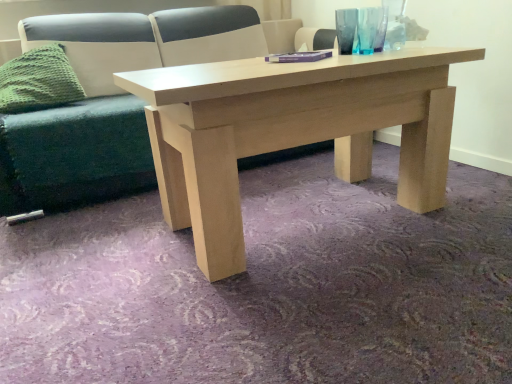
Find the location of a particular element. transparent glass vase at upper right is located at coordinates (367, 29).

The image size is (512, 384). Describe the element at coordinates (74, 155) in the screenshot. I see `green fabric couch at center` at that location.

Find the location of a particular element. transparent glass vase at upper right is located at coordinates (367, 29).

Is green knitted pillow at left bigger or smaller than green fabric couch at center?

In the image, green knitted pillow at left appears to be smaller than green fabric couch at center.

Can you tell me how much green knitted pillow at left and green fabric couch at center differ in facing direction?

They differ by 0.000168 degrees in their facing directions.

Considering the points (48, 100) and (128, 180), which point is behind, point (48, 100) or point (128, 180)?

Point (48, 100)

Could you tell me if green knitted pillow at left is turned towards green fabric couch at center?

Yes.

Where is `studio couch that is above the purple matte book at center (from the image's perspective)`? The image size is (512, 384). studio couch that is above the purple matte book at center (from the image's perspective) is located at coordinates (74, 155).

In terms of width, does green fabric couch at center look wider or thinner when compared to purple matte book at center?

Considering their sizes, green fabric couch at center looks broader than purple matte book at center.

Based on the photo, from a real-world perspective, which object stands above the other?

purple matte book at center, from a real-world perspective.

Looking at this image, is green fabric couch at center taller or shorter than purple matte book at center?

Considering their sizes, green fabric couch at center has more height than purple matte book at center.

Based on the photo, how much distance is there between green knitted pillow at left and purple matte book at center?

green knitted pillow at left is 3.96 feet from purple matte book at center.

You are a GUI agent. You are given a task and a screenshot of the screen. Output one action in this format:
    pyautogui.click(x=<x>, y=<y>)
    Task: Click on the book that is above the green knitted pillow at left (from a real-world perspective)
    The image size is (512, 384).
    Given the screenshot: What is the action you would take?
    pyautogui.click(x=298, y=57)

Considering the sizes of green knitted pillow at left and purple matte book at center in the image, is green knitted pillow at left wider or thinner than purple matte book at center?

green knitted pillow at left is wider than purple matte book at center.

Does green knitted pillow at left come behind purple matte book at center?

Yes, green knitted pillow at left is further from the viewer.

Is green fabric couch at center facing away from transparent glass vase at upper right?

green fabric couch at center is not turned away from transparent glass vase at upper right.

Can you tell me how much green fabric couch at center and transparent glass vase at upper right differ in facing direction?

green fabric couch at center and transparent glass vase at upper right are facing 1.16 degrees away from each other.

From the image's perspective, which is below, green fabric couch at center or transparent glass vase at upper right?

From the image's view, green fabric couch at center is below.

Image resolution: width=512 pixels, height=384 pixels. What are the coordinates of `glass vase behind the green fabric couch at center` in the screenshot? It's located at (367, 29).

From a real-world perspective, is transparent glass vase at upper right above or below green fabric couch at center?

From a real-world perspective, transparent glass vase at upper right is physically above green fabric couch at center.

Would you say transparent glass vase at upper right is a long distance from green fabric couch at center?

Yes, transparent glass vase at upper right and green fabric couch at center are quite far apart.

From the picture: In terms of size, does transparent glass vase at upper right appear bigger or smaller than green fabric couch at center?

transparent glass vase at upper right is smaller than green fabric couch at center.

Is transparent glass vase at upper right to the left of green fabric couch at center from the viewer's perspective?

No.

In the scene shown: From the image's perspective, is transparent glass vase at upper right over green knitted pillow at left?

Correct, transparent glass vase at upper right appears higher than green knitted pillow at left in the image.

Is transparent glass vase at upper right to the left or to the right of green knitted pillow at left in the image?

transparent glass vase at upper right is to the right of green knitted pillow at left.

This screenshot has height=384, width=512. I want to click on pillow below the transparent glass vase at upper right (from a real-world perspective), so click(x=38, y=81).

Can you tell me how much purple matte book at center and green fabric couch at center differ in facing direction?

purple matte book at center and green fabric couch at center are facing 33.4 degrees away from each other.

Is point (314, 56) closer to viewer compared to point (250, 163)?

Yes, it is in front of point (250, 163).

Considering the positions of objects purple matte book at center and green fabric couch at center in the image provided, who is more to the right, purple matte book at center or green fabric couch at center?

From the viewer's perspective, purple matte book at center appears more on the right side.

Is green fabric couch at center completely or partially inside purple matte book at center?

No, green fabric couch at center is not a part of purple matte book at center.

At what (x,y) coordinates should I click in order to perform the action: click on studio couch lying above the green knitted pillow at left (from the image's perspective). Please return your answer as a coordinate pair (x, y). Looking at the image, I should click on (74, 155).

Image resolution: width=512 pixels, height=384 pixels. Find the location of `book located on the right of green fabric couch at center`. book located on the right of green fabric couch at center is located at coordinates pyautogui.click(x=298, y=57).

When comparing their distances from transparent glass vase at upper right, does purple matte book at center or green fabric couch at center seem further?

green fabric couch at center lies further to transparent glass vase at upper right than the other object.

Looking at the image, which one is located further to purple matte book at center, green fabric couch at center or green knitted pillow at left?

Based on the image, green knitted pillow at left appears to be further to purple matte book at center.

Looking at the image, which one is located further to transparent glass vase at upper right, green fabric couch at center or green knitted pillow at left?

The object further to transparent glass vase at upper right is green knitted pillow at left.

Considering their positions, is green knitted pillow at left positioned closer to green fabric couch at center than transparent glass vase at upper right?

Among the two, green knitted pillow at left is located nearer to green fabric couch at center.

When comparing their distances from green knitted pillow at left, does transparent glass vase at upper right or green fabric couch at center seem further?

transparent glass vase at upper right is further to green knitted pillow at left.

Considering their positions, is green fabric couch at center positioned further to transparent glass vase at upper right than purple matte book at center?

Among the two, green fabric couch at center is located further to transparent glass vase at upper right.

From the picture: Estimate the real-world distances between objects in this image. Which object is closer to transparent glass vase at upper right, green knitted pillow at left or green fabric couch at center?

Among the two, green fabric couch at center is located nearer to transparent glass vase at upper right.

Looking at the image, which one is located closer to green knitted pillow at left, purple matte book at center or transparent glass vase at upper right?

purple matte book at center is positioned closer to the anchor green knitted pillow at left.

Where is `studio couch between green knitted pillow at left and purple matte book at center`? studio couch between green knitted pillow at left and purple matte book at center is located at coordinates (74, 155).

I want to click on book between green fabric couch at center and transparent glass vase at upper right in the horizontal direction, so click(298, 57).

Find the location of a particular element. Image resolution: width=512 pixels, height=384 pixels. studio couch located between green knitted pillow at left and transparent glass vase at upper right in the left-right direction is located at coordinates (74, 155).

The height and width of the screenshot is (384, 512). I want to click on book located between green knitted pillow at left and transparent glass vase at upper right in the left-right direction, so click(298, 57).